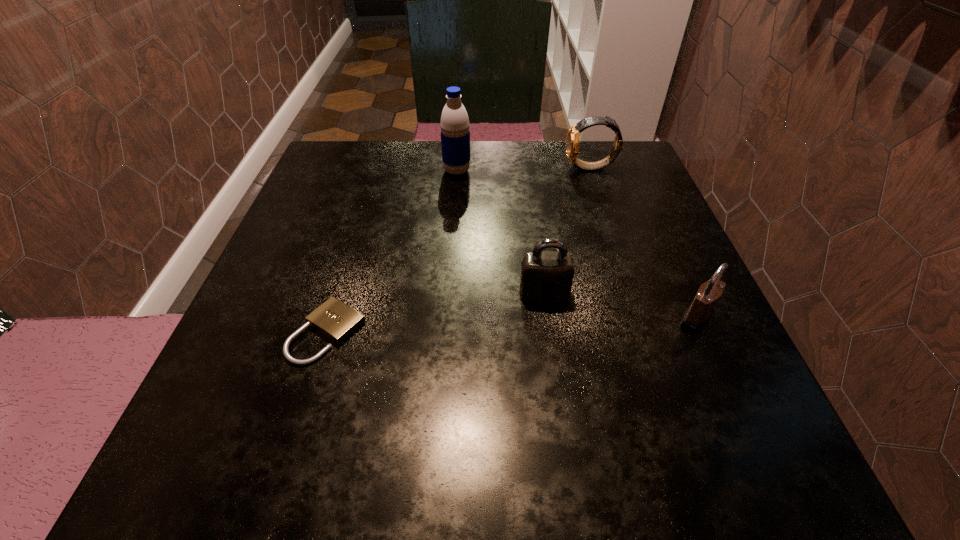
In order to click on vacant area situated 0.380m on the face of the watch in this screenshot , I will do `click(401, 168)`.

In order to click on vacant space situated 0.260m at the front of the third object from left to right near the keyhole in this screenshot , I will do `click(567, 461)`.

Find the location of a particular element. Image resolution: width=960 pixels, height=540 pixels. free space located on the back of the rightmost padlock is located at coordinates (639, 190).

Identify the location of vacant point located on the back of the shortest padlock. (376, 175).

At what (x,y) coordinates should I click in order to perform the action: click on water bottle that is at the far edge. Please return your answer as a coordinate pair (x, y). Image resolution: width=960 pixels, height=540 pixels. Looking at the image, I should click on (455, 134).

The image size is (960, 540). I want to click on watch at the far edge, so click(x=572, y=143).

Where is `object positioned at the left edge`? Image resolution: width=960 pixels, height=540 pixels. object positioned at the left edge is located at coordinates (334, 319).

The height and width of the screenshot is (540, 960). Find the location of `watch that is at the right edge`. watch that is at the right edge is located at coordinates (572, 143).

Where is `padlock that is at the right edge`? This screenshot has width=960, height=540. padlock that is at the right edge is located at coordinates (698, 314).

Locate an element on the screen. object that is at the far right corner is located at coordinates (572, 143).